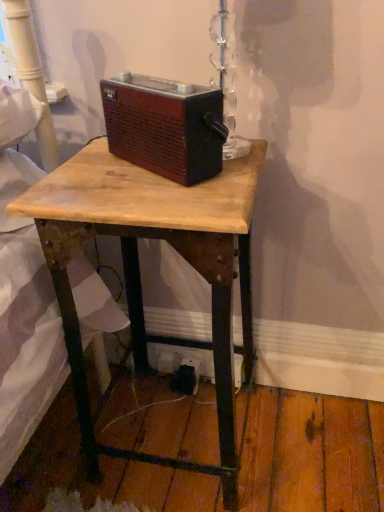
Question: Can you confirm if black plastic outlet at lower center is positioned to the left of brown wood radio at center?

Choices:
 (A) no
 (B) yes

Answer: (A)

Question: Does black plastic outlet at lower center lie behind brown wood radio at center?

Choices:
 (A) no
 (B) yes

Answer: (B)

Question: Does black plastic outlet at lower center have a greater height compared to brown wood radio at center?

Choices:
 (A) yes
 (B) no

Answer: (B)

Question: Is black plastic outlet at lower center thinner than brown wood radio at center?

Choices:
 (A) yes
 (B) no

Answer: (A)

Question: From the image's perspective, does black plastic outlet at lower center appear higher than brown wood radio at center?

Choices:
 (A) yes
 (B) no

Answer: (B)

Question: Is wooden desk at center bigger or smaller than brown wood radio at center?

Choices:
 (A) big
 (B) small

Answer: (A)

Question: From the image's perspective, is wooden desk at center above or below brown wood radio at center?

Choices:
 (A) below
 (B) above

Answer: (A)

Question: Considering the positions of wooden desk at center and brown wood radio at center in the image, is wooden desk at center wider or thinner than brown wood radio at center?

Choices:
 (A) thin
 (B) wide

Answer: (B)

Question: Is point (221, 263) closer or farther from the camera than point (140, 113)?

Choices:
 (A) closer
 (B) farther

Answer: (A)

Question: Considering their positions, is brown wood radio at center located in front of or behind black plastic outlet at lower center?

Choices:
 (A) front
 (B) behind

Answer: (A)

Question: Considering the relative positions of brown wood radio at center and black plastic outlet at lower center in the image provided, is brown wood radio at center to the left or to the right of black plastic outlet at lower center?

Choices:
 (A) left
 (B) right

Answer: (A)

Question: From a real-world perspective, is brown wood radio at center physically located above or below black plastic outlet at lower center?

Choices:
 (A) below
 (B) above

Answer: (B)

Question: Considering the positions of brown wood radio at center and black plastic outlet at lower center in the image, is brown wood radio at center bigger or smaller than black plastic outlet at lower center?

Choices:
 (A) big
 (B) small

Answer: (A)

Question: From their relative heights in the image, would you say black plastic outlet at lower center is taller or shorter than brown wood radio at center?

Choices:
 (A) short
 (B) tall

Answer: (A)

Question: In terms of width, does black plastic outlet at lower center look wider or thinner when compared to brown wood radio at center?

Choices:
 (A) thin
 (B) wide

Answer: (A)